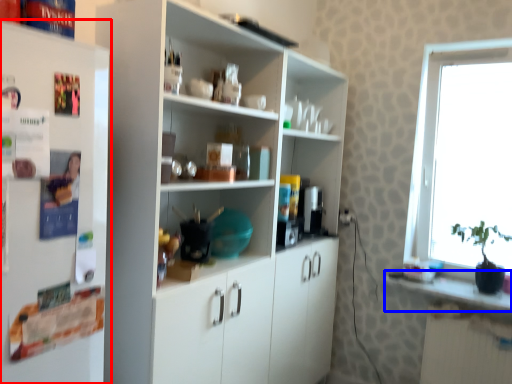
Question: Which point is closer to the camera, refrigerator (highlighted by a red box) or counter top (highlighted by a blue box)?

Choices:
 (A) refrigerator
 (B) counter top

Answer: (A)